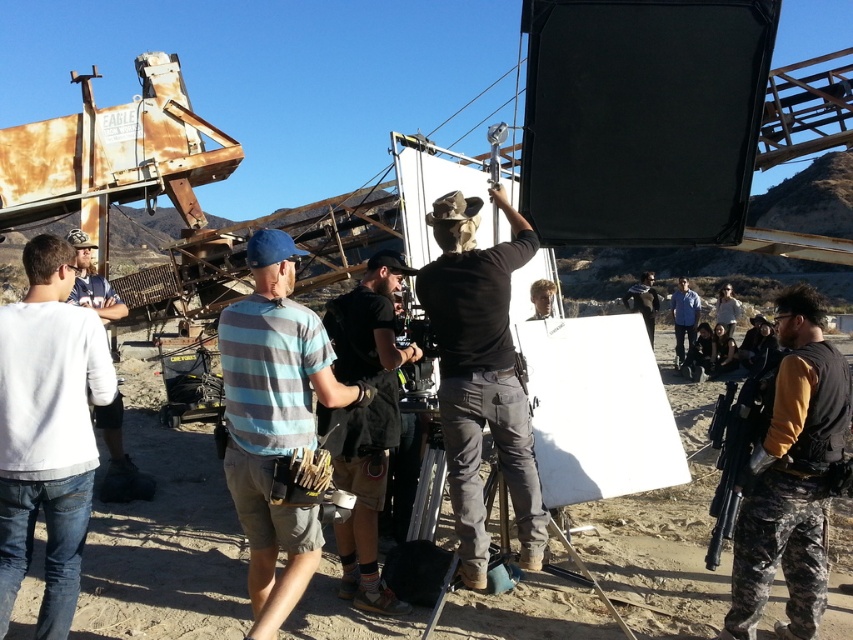
Question: Is black cotton shirt at center wider than dark gray fabric jacket at center?

Choices:
 (A) yes
 (B) no

Answer: (B)

Question: From the image, what is the correct spatial relationship of camouflage pants at center in relation to white matte shirt at left?

Choices:
 (A) above
 (B) below

Answer: (B)

Question: Observing the image, what is the correct spatial positioning of metallic silver tripod at center in reference to white matte shirt at left?

Choices:
 (A) above
 (B) below

Answer: (B)

Question: Which of these objects is positioned farthest from the white matte shirt at left?

Choices:
 (A) black matte gun at right
 (B) metallic silver tripod at center
 (C) camouflage pants at center

Answer: (C)

Question: Which is farther from the blue shirt at center?

Choices:
 (A) white matte shirt at left
 (B) black matte shirt at center

Answer: (B)

Question: Which object appears farthest from the camera in this image?

Choices:
 (A) black matte shirt at center
 (B) camouflage pants at center

Answer: (B)